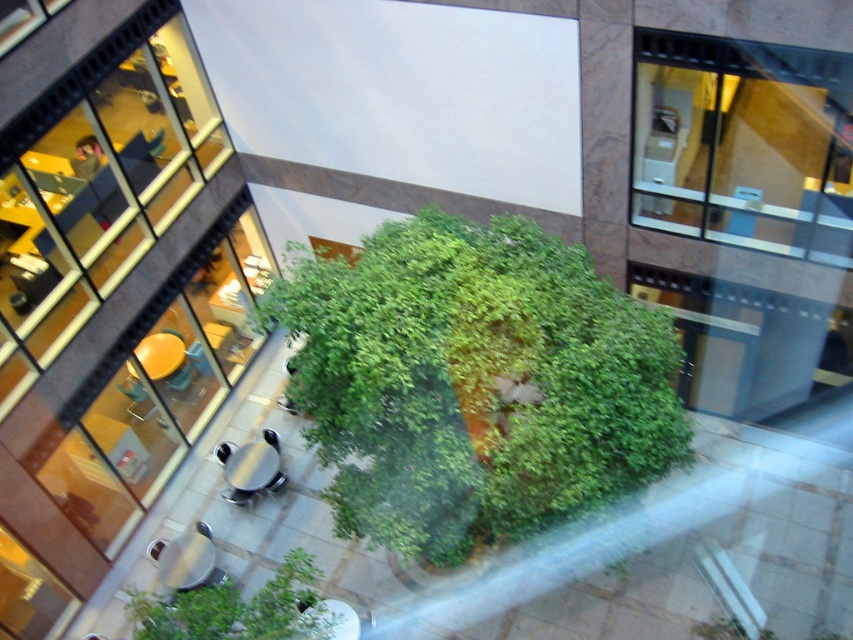
You are planning to place a new bench in the courtyard. The bench is 2 meters long and needs to be placed between the green leafy bush at center and the green leafy bush at lower center. Can you fit the bench horizontally between them?

The green leafy bush at center is above the green leafy bush at lower center. The vertical distance between them is not specified, so we cannot determine if the bench will fit horizontally between them.

You are a maintenance worker needing to water two green leafy bushes in the courtyard. The watering can you have can hold enough water for 3 meters of travel. Starting from the green leafy bush at center, can you reach the green leafy bush at lower center without refilling the watering can?

The distance between the green leafy bush at center and the green leafy bush at lower center is 2.88 meters. Since the watering can can hold enough water for 3 meters of travel, you can reach the green leafy bush at lower center without needing to refill.